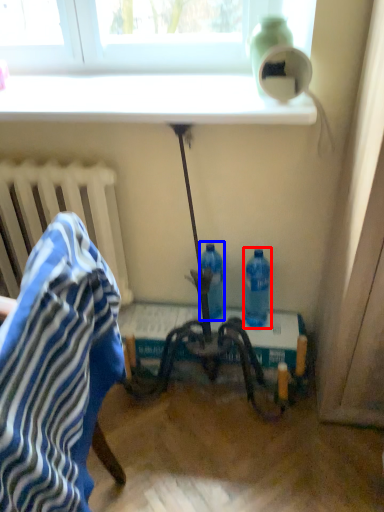
Question: Which point is closer to the camera, bottle (highlighted by a red box) or bottle (highlighted by a blue box)?

Choices:
 (A) bottle
 (B) bottle

Answer: (A)